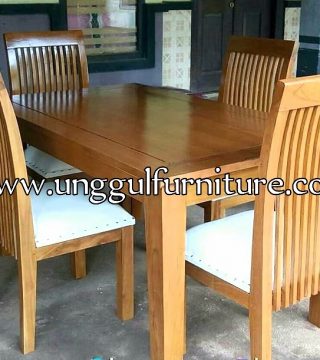
Locate an element on the screen. The height and width of the screenshot is (360, 320). black frame is located at coordinates (115, 60), (146, 47), (62, 18).